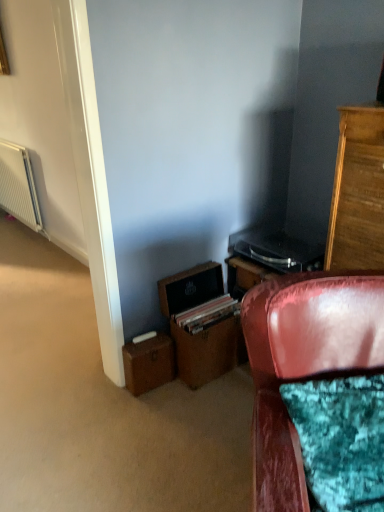
Question: Is brown cardboard box at lower left further to the viewer compared to velvet red chair at lower right?

Choices:
 (A) yes
 (B) no

Answer: (A)

Question: Can you confirm if brown cardboard box at lower left is positioned to the right of velvet red chair at lower right?

Choices:
 (A) no
 (B) yes

Answer: (A)

Question: Can you confirm if brown cardboard box at lower left is taller than velvet red chair at lower right?

Choices:
 (A) no
 (B) yes

Answer: (A)

Question: Considering the relative sizes of brown cardboard box at lower left and velvet red chair at lower right in the image provided, is brown cardboard box at lower left thinner than velvet red chair at lower right?

Choices:
 (A) no
 (B) yes

Answer: (B)

Question: From a real-world perspective, is brown cardboard box at lower left beneath velvet red chair at lower right?

Choices:
 (A) yes
 (B) no

Answer: (A)

Question: Does brown cardboard box at lower left turn towards velvet red chair at lower right?

Choices:
 (A) yes
 (B) no

Answer: (A)

Question: Is the depth of brown leather file cabinet at lower center less than that of velvet red chair at lower right?

Choices:
 (A) no
 (B) yes

Answer: (A)

Question: Is brown leather file cabinet at lower center far from velvet red chair at lower right?

Choices:
 (A) yes
 (B) no

Answer: (B)

Question: From a real-world perspective, is brown leather file cabinet at lower center positioned under velvet red chair at lower right based on gravity?

Choices:
 (A) yes
 (B) no

Answer: (A)

Question: From the image's perspective, does brown leather file cabinet at lower center appear higher than velvet red chair at lower right?

Choices:
 (A) no
 (B) yes

Answer: (B)

Question: Is brown leather file cabinet at lower center oriented towards velvet red chair at lower right?

Choices:
 (A) yes
 (B) no

Answer: (A)

Question: Is brown leather file cabinet at lower center to the right of velvet red chair at lower right from the viewer's perspective?

Choices:
 (A) yes
 (B) no

Answer: (B)

Question: Does white textured radiator at left appear on the right side of velvet red chair at lower right?

Choices:
 (A) yes
 (B) no

Answer: (B)